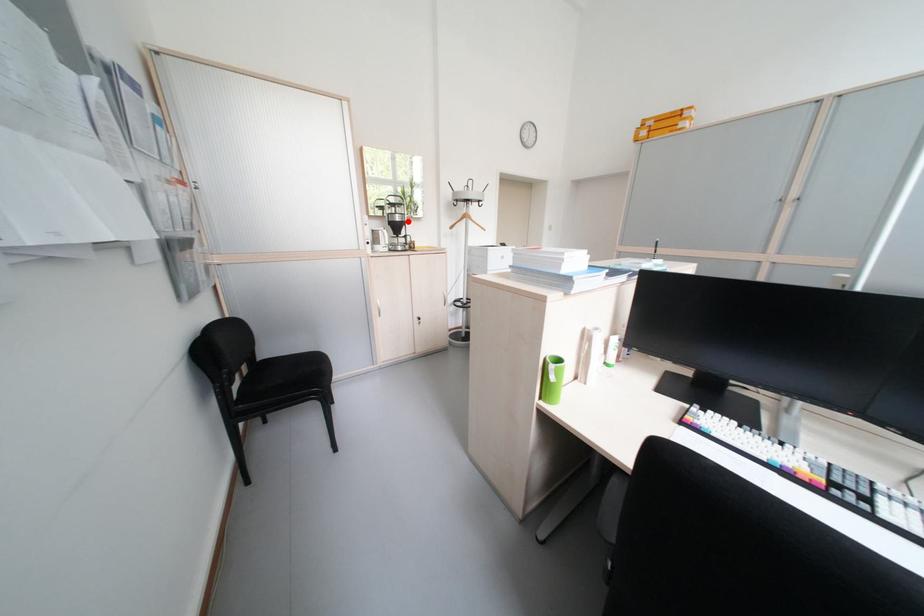
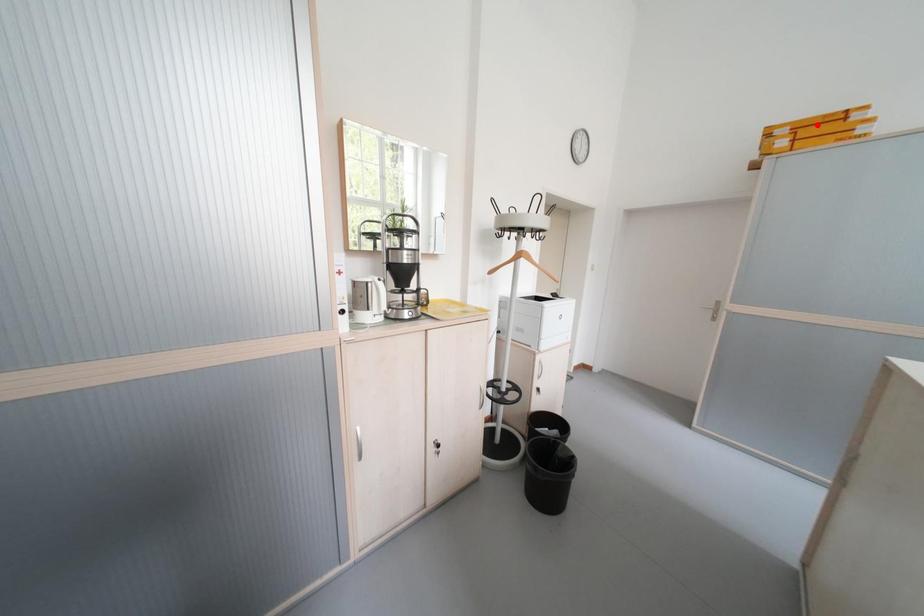
I am providing you with two images of the same scene from different viewpoints. A red point is marked on the first image and another point is marked on the second image. Is the red point in image1 aligned with the point shown in image2?

No